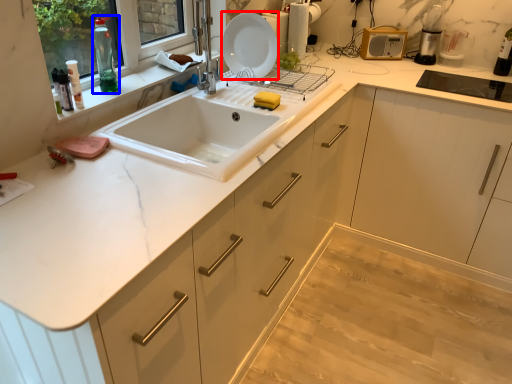
Question: Among these objects, which one is farthest to the camera, plate (highlighted by a red box) or bottle (highlighted by a blue box)?

Choices:
 (A) plate
 (B) bottle

Answer: (A)